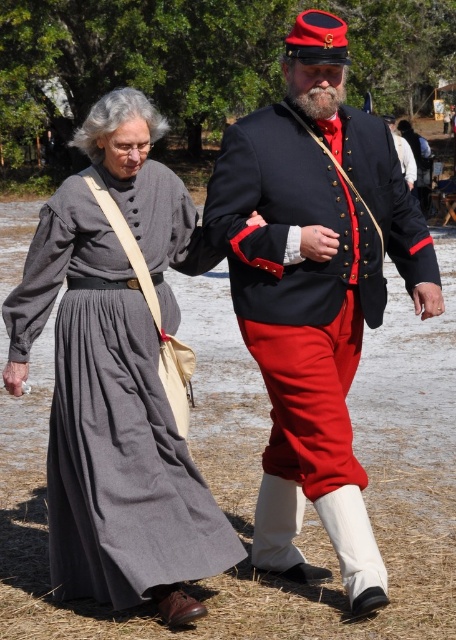
Question: Does gray cotton dress at left have a larger size compared to white leather glove at center?

Choices:
 (A) no
 (B) yes

Answer: (B)

Question: Which object appears farthest from the camera in this image?

Choices:
 (A) smooth skin hand at lower left
 (B) smooth leather glove at center
 (C) gray cotton dress at left

Answer: (A)

Question: Based on their relative distances, which object is farther from the smooth skin hand at lower left?

Choices:
 (A) smooth leather glove at center
 (B) matte black glove at upper center

Answer: (A)

Question: Does gray cotton dress at left appear on the right side of white leather glove at center?

Choices:
 (A) yes
 (B) no

Answer: (B)

Question: Which object is closer to the camera taking this photo?

Choices:
 (A) gray cotton dress at left
 (B) smooth leather glove at center
 (C) smooth skin hand at lower left
 (D) white leather glove at center

Answer: (A)

Question: Does shiny black coat at center appear under gray cotton dress at left?

Choices:
 (A) no
 (B) yes

Answer: (A)